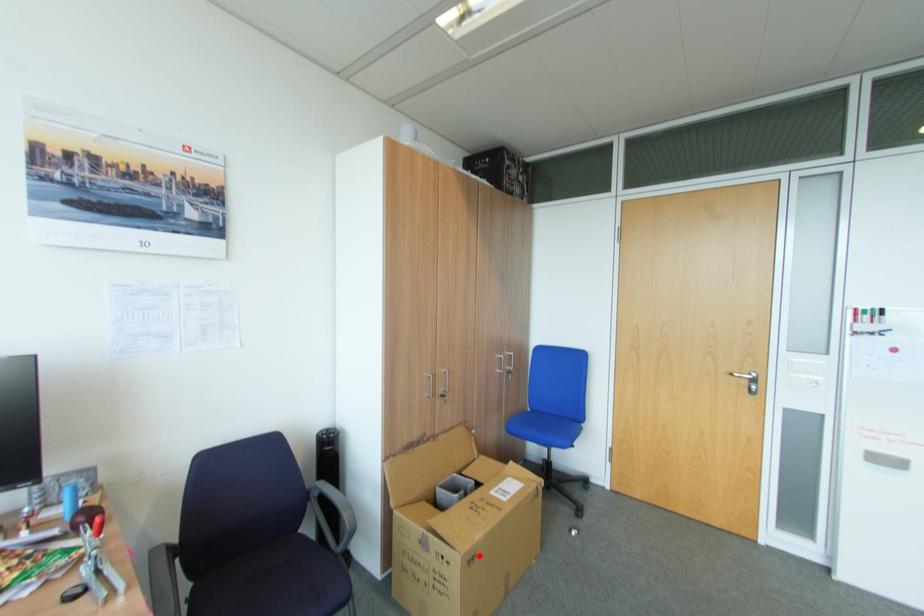
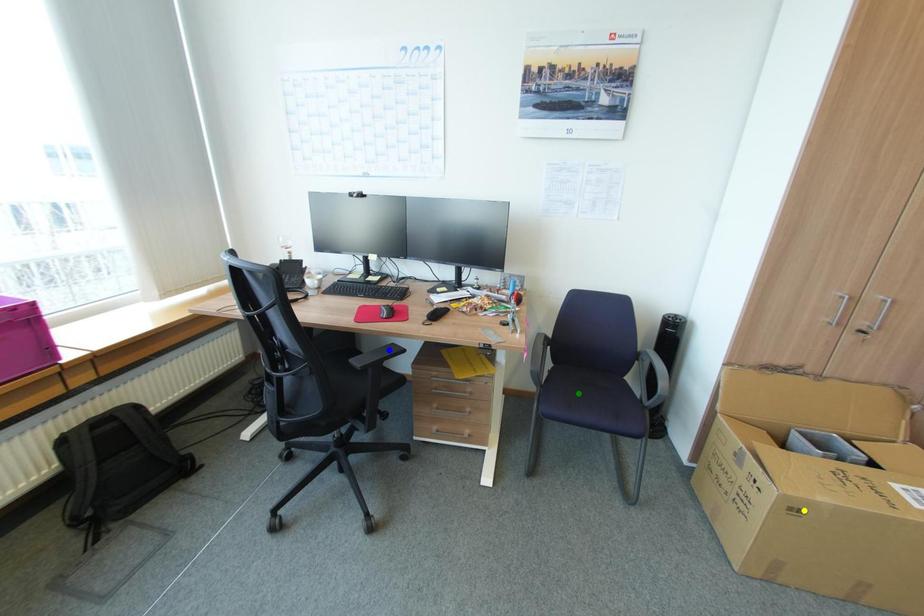
Question: I am providing you with two images of the same scene from different viewpoints. A red point is marked on the first image. You are given multiple points on the second image. Which point in image 2 represents the same 3d spot as the red point in image 1?

Choices:
 (A) blue point
 (B) green point
 (C) yellow point

Answer: (C)